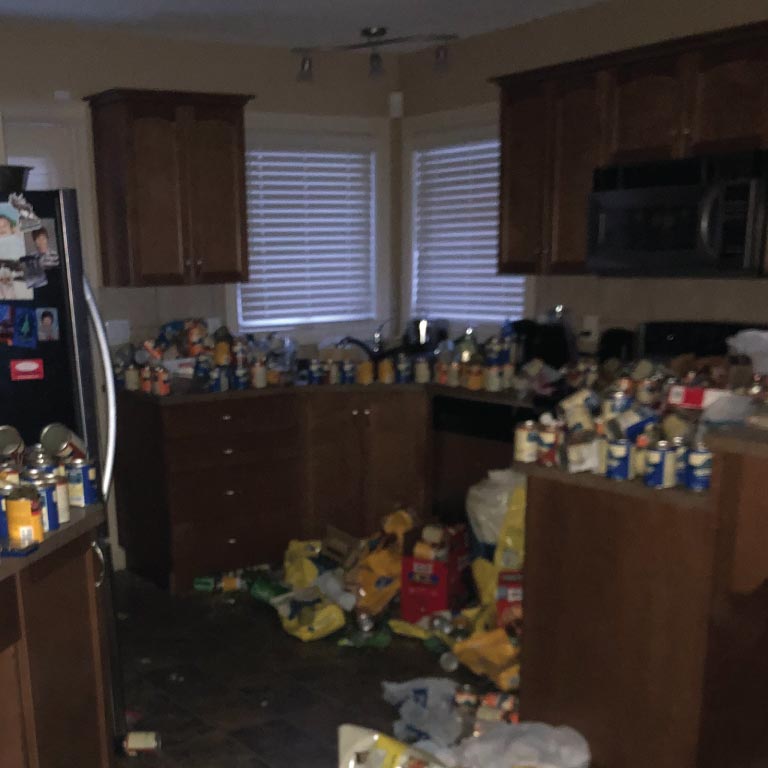
This screenshot has width=768, height=768. What are the coordinates of `lights` in the screenshot? It's located at (362, 54), (290, 75), (435, 58).